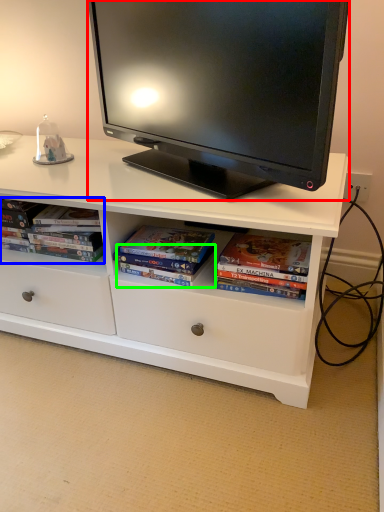
Question: Based on their relative distances, which object is nearer to television (highlighted by a red box)? Choose from book (highlighted by a blue box) and paperback book (highlighted by a green box).

Choices:
 (A) book
 (B) paperback book

Answer: (A)